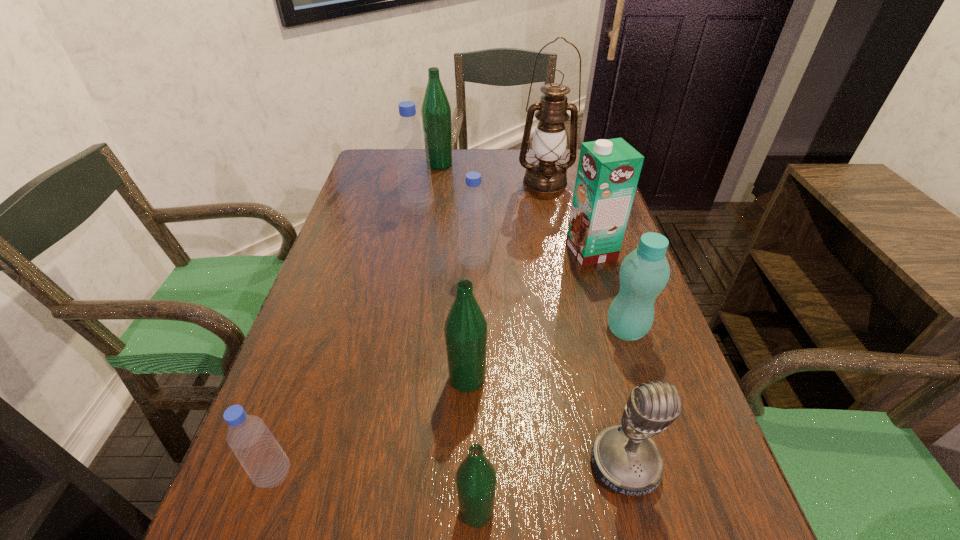
Find the location of a particular element. This screenshot has height=540, width=960. the third nearest bottle is located at coordinates (465, 329).

Find the location of a particular element. The width and height of the screenshot is (960, 540). the fifth nearest object is located at coordinates [644, 272].

Image resolution: width=960 pixels, height=540 pixels. In order to click on the fourth farthest bottle in this screenshot , I will do `click(644, 272)`.

The image size is (960, 540). I want to click on microphone, so click(x=626, y=460).

The width and height of the screenshot is (960, 540). I want to click on the leftmost bottle, so click(x=259, y=453).

You are a GUI agent. You are given a task and a screenshot of the screen. Output one action in this format:
    pyautogui.click(x=<x>, y=<y>)
    Task: Click on the leftmost object
    The image size is (960, 540).
    Given the screenshot: What is the action you would take?
    pyautogui.click(x=259, y=453)

Where is `the nearest green bottle`? the nearest green bottle is located at coordinates (476, 478).

At what (x,y) coordinates should I click in order to perform the action: click on free region located on the back of the brown oil lamp. Please return your answer as a coordinate pair (x, y). The height and width of the screenshot is (540, 960). Looking at the image, I should click on (540, 161).

I want to click on vacant region located on the front of the second blue bottle from left to right, so click(x=396, y=321).

This screenshot has height=540, width=960. Identify the location of vacant space located 0.210m on the front of the leftmost green bottle. (434, 207).